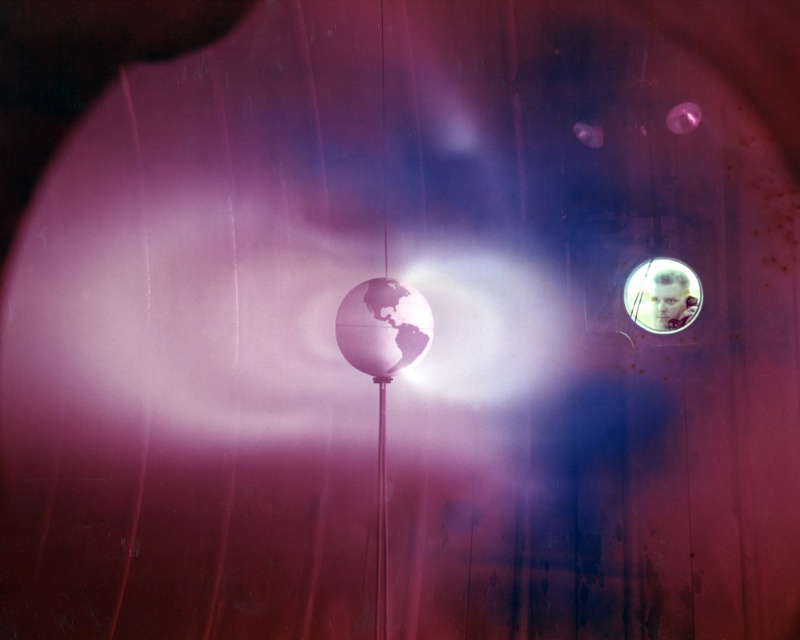
You are an interior designer assessing the spatial dimensions of this surreal room. Given that the matte metallic globe at center and the translucent plastic bubble at upper right are both central to the design, which object occupies a larger vertical space in the composition?

The matte metallic globe at center has a greater height compared to the translucent plastic bubble at upper right, so it occupies a larger vertical space in the composition.

You are an interior designer planning to place a new decorative item between the matte metallic globe at center and the metallic pole at center. Considering their sizes, which object should you place the item closer to?

The matte metallic globe at center is wider than the metallic pole at center, so you should place the new decorative item closer to the metallic pole at center to maintain balance.